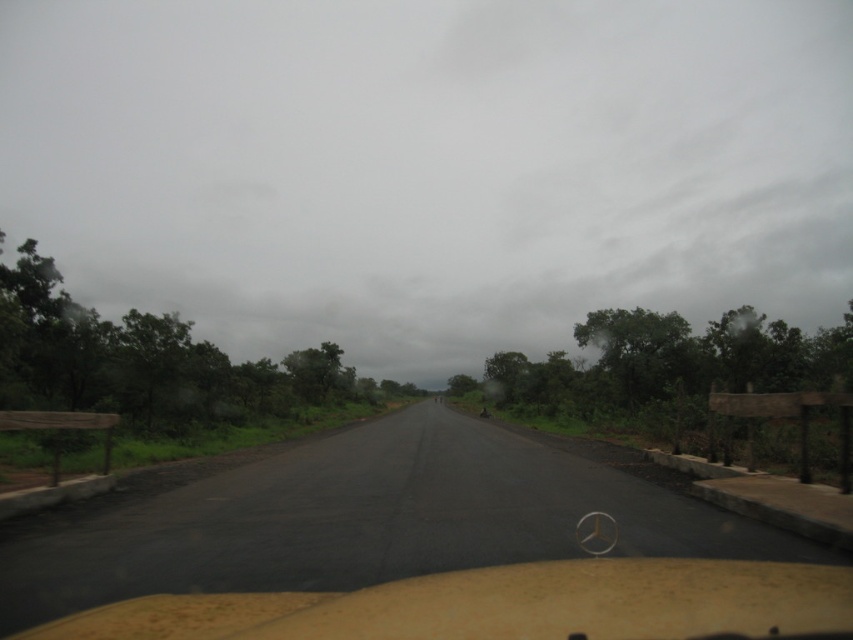
At what (x,y) coordinates should I click in order to perform the action: click on gray cloudy sky at upper center. Please return your answer as a coordinate pair (x, y). Looking at the image, I should click on (431, 166).

Locate an element on the screen. The height and width of the screenshot is (640, 853). gray cloudy sky at upper center is located at coordinates (431, 166).

Locate an element on the screen. The width and height of the screenshot is (853, 640). gray cloudy sky at upper center is located at coordinates pos(431,166).

Is point (506, 621) more distant than point (173, 403)?

No, it is not.

Does point (318, 620) come closer to viewer compared to point (76, 308)?

Yes, it is in front of point (76, 308).

You are a GUI agent. You are given a task and a screenshot of the screen. Output one action in this format:
    pyautogui.click(x=<x>, y=<y>)
    Task: Click on the yellow matte dashboard at center
    This screenshot has width=853, height=640.
    Given the screenshot: What is the action you would take?
    pyautogui.click(x=506, y=605)

Can you confirm if gray cloudy sky at upper center is thinner than yellow matte dashboard at center?

No.

Between gray cloudy sky at upper center and yellow matte dashboard at center, which one is positioned higher?

gray cloudy sky at upper center is higher up.

Locate an element on the screen. Image resolution: width=853 pixels, height=640 pixels. gray cloudy sky at upper center is located at coordinates pos(431,166).